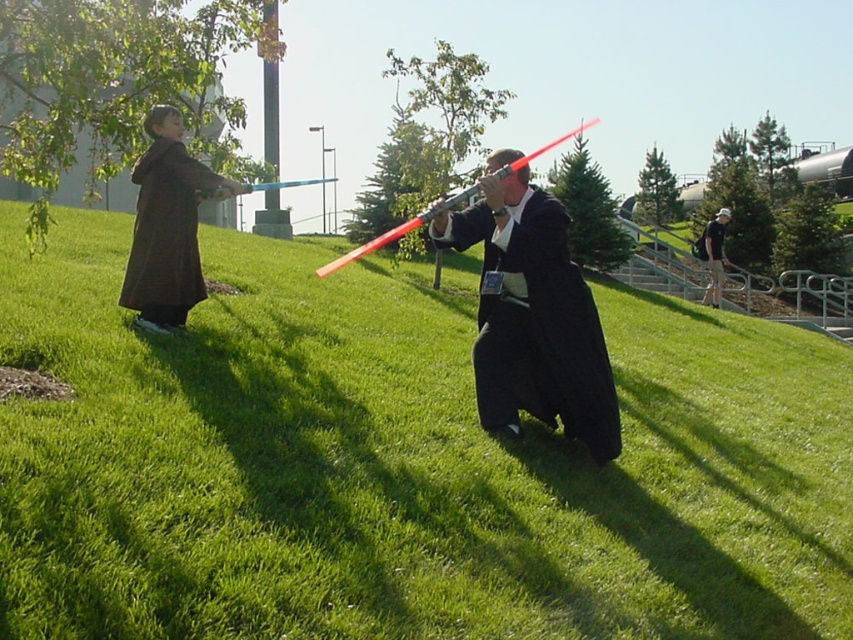
Question: Among these points, which one is nearest to the camera?

Choices:
 (A) (563, 324)
 (B) (173, 204)
 (C) (425, 410)

Answer: (A)

Question: Can you confirm if black matte robe at center is wider than matte brown robe at left?

Choices:
 (A) yes
 (B) no

Answer: (A)

Question: Does green grassy at center appear on the right side of black matte robe at center?

Choices:
 (A) no
 (B) yes

Answer: (A)

Question: Which object appears farthest from the camera in this image?

Choices:
 (A) matte brown robe at left
 (B) green grassy at center
 (C) black matte robe at center

Answer: (A)

Question: Can you confirm if black matte robe at center is positioned above matte brown robe at left?

Choices:
 (A) yes
 (B) no

Answer: (B)

Question: Which point appears farthest from the camera in this image?

Choices:
 (A) (491, 237)
 (B) (155, 145)
 (C) (418, 435)

Answer: (B)